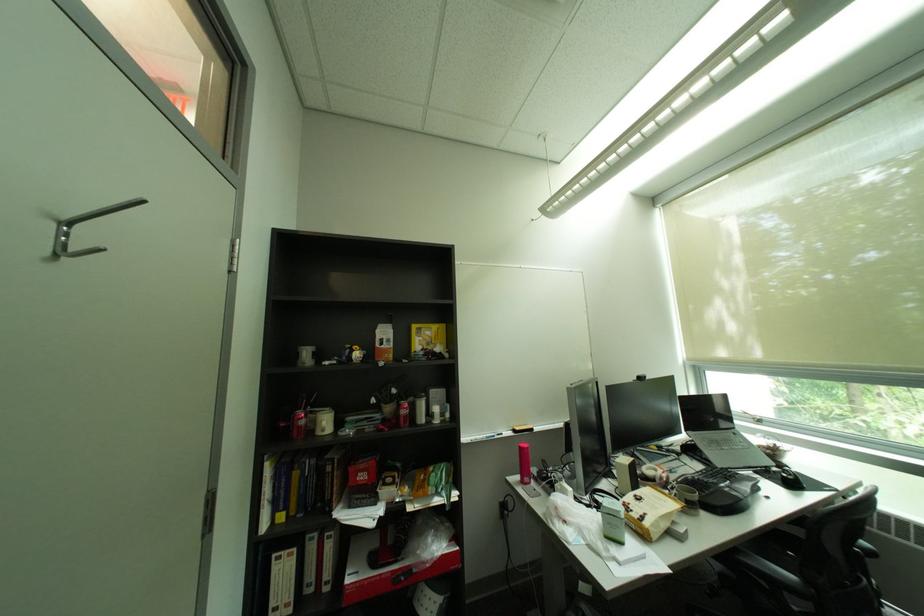
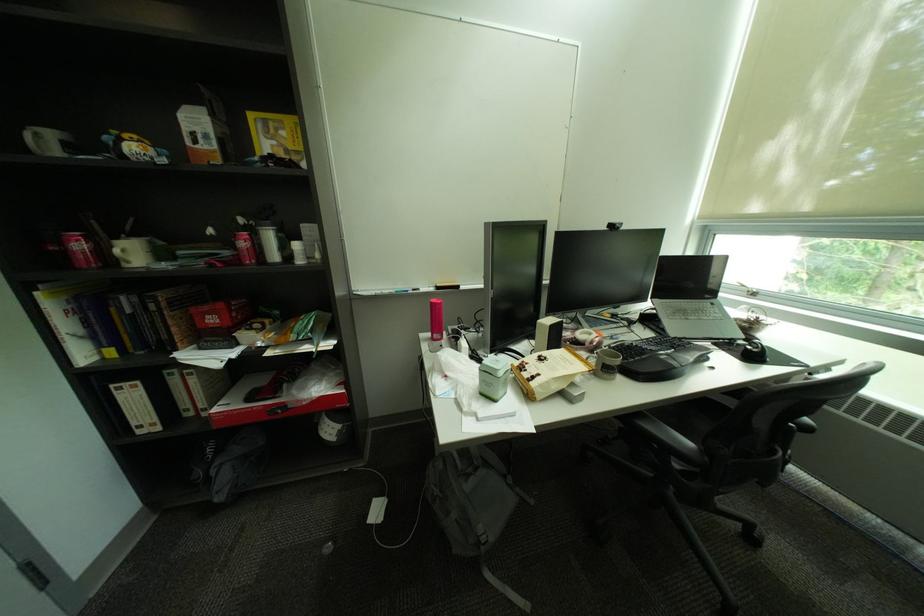
Locate, in the second image, the point that corresponds to [803,578] in the first image.

(700, 445)